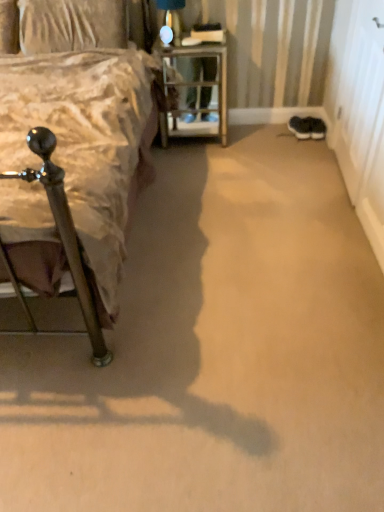
At what (x,y) coordinates should I click in order to perform the action: click on free spot in front of metal/textured nightstand at center. Please return your answer as a coordinate pair (x, y). This screenshot has width=384, height=512. Looking at the image, I should click on (200, 164).